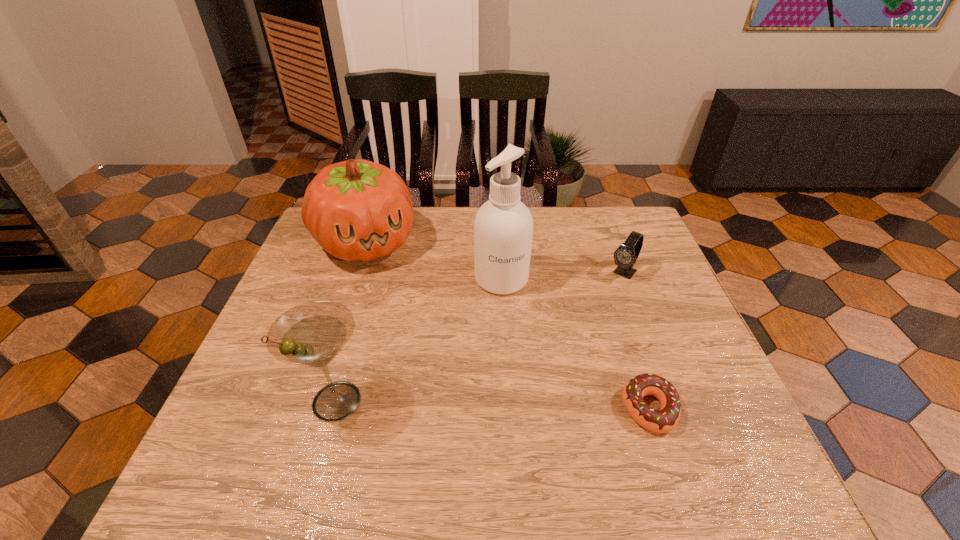
What are the coordinates of `vacant spot on the desktop that is between the martini and the shortest object and is positioned on the face of the fourth tallest object` in the screenshot? It's located at (513, 406).

The width and height of the screenshot is (960, 540). I want to click on free space on the desktop that is between the martini and the doughnut and is positioned on the side of the pumpkin with the cute face, so click(446, 404).

Locate an element on the screen. This screenshot has width=960, height=540. free space on the desktop that is between the martini and the doughnut and is positioned on the front label of the third object from right to left is located at coordinates (537, 406).